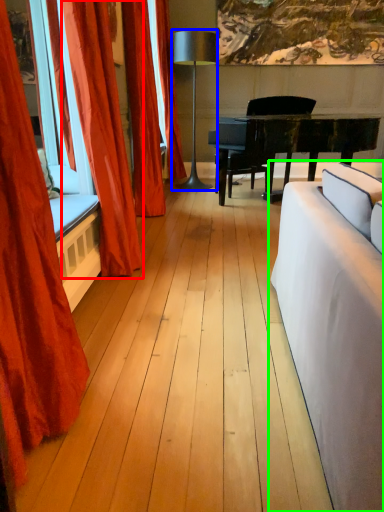
Question: Which object is positioned farthest from curtain (highlighted by a red box)? Select from lamp (highlighted by a blue box) and studio couch (highlighted by a green box).

Choices:
 (A) lamp
 (B) studio couch

Answer: (A)